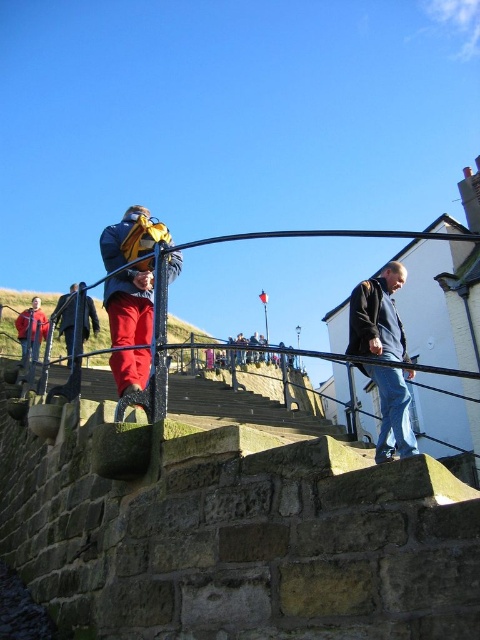
Question: In this image, where is dark blue jacket at upper right located relative to matte red jacket at center?

Choices:
 (A) right
 (B) left

Answer: (A)

Question: Which object is farther from the camera taking this photo?

Choices:
 (A) matte red jacket at lower left
 (B) dark blue jacket at upper right
 (C) red fabric jacket at upper left
 (D) matte red jacket at center

Answer: (A)

Question: Can you confirm if dark blue jacket at upper right is smaller than red fabric jacket at upper left?

Choices:
 (A) no
 (B) yes

Answer: (B)

Question: Which point is farther from the camera taking this photo?

Choices:
 (A) (385, 314)
 (B) (17, 332)
 (C) (145, 356)

Answer: (B)

Question: Which object is farther from the camera taking this photo?

Choices:
 (A) matte red jacket at lower left
 (B) dark blue jacket at upper right

Answer: (A)

Question: From the image, what is the correct spatial relationship of red fabric jacket at upper left in relation to matte red jacket at lower left?

Choices:
 (A) left
 (B) right

Answer: (A)